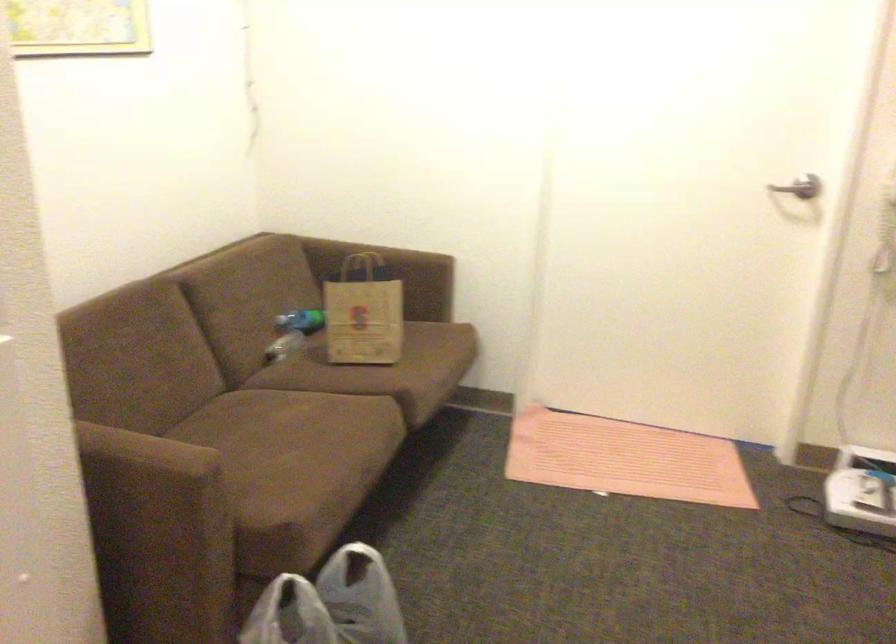
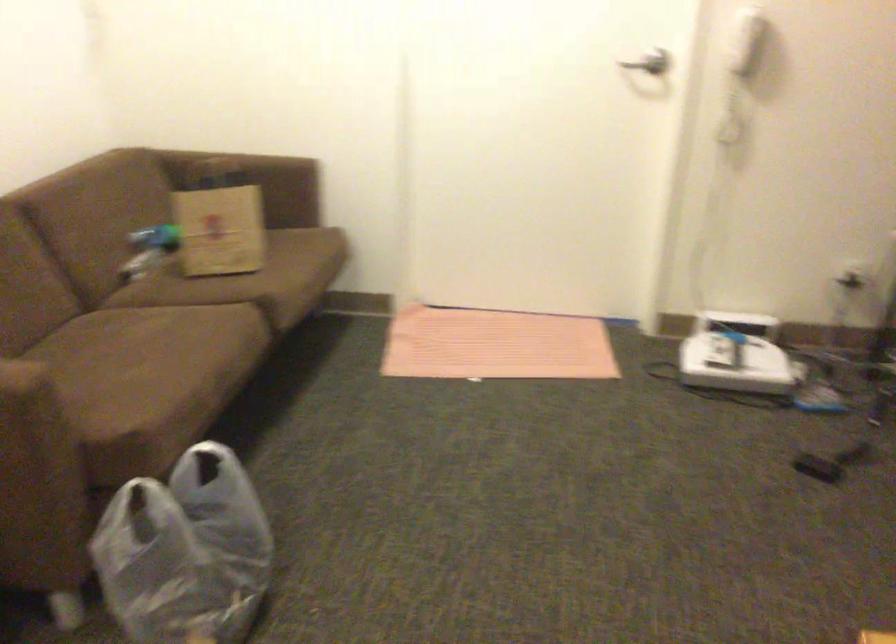
Where in the second image is the point corresponding to point (181, 324) from the first image?

(23, 242)